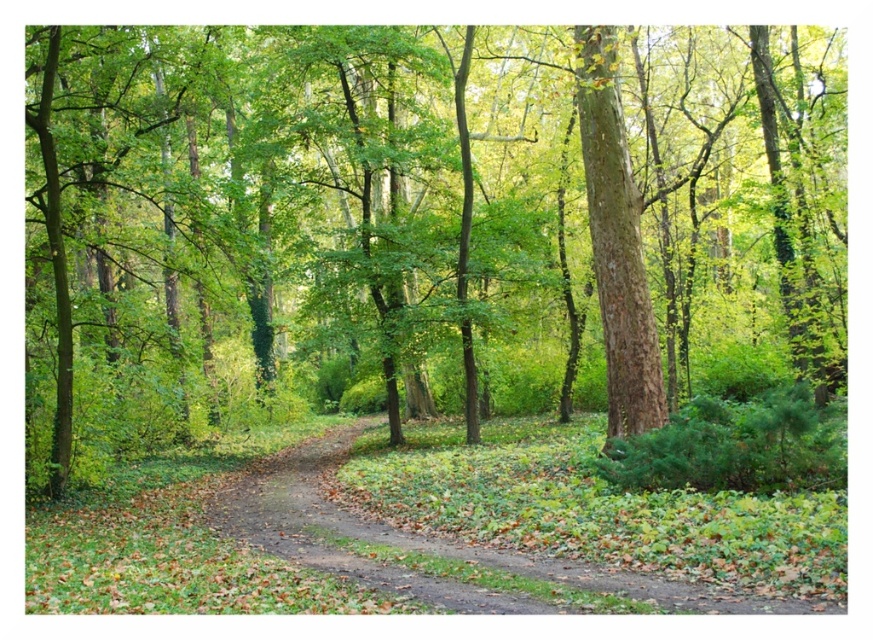
Between point (287, 465) and point (615, 326), which one is positioned behind?

The point (287, 465) is more distant.

Which is in front, point (620, 515) or point (605, 68)?

Point (620, 515) is more forward.

Find the location of a particular element. brown dirt path at center is located at coordinates (498, 531).

Describe the element at coordinates (414, 220) in the screenshot. This screenshot has height=640, width=873. I see `brown rough tree at center` at that location.

Which is in front, point (836, 228) or point (727, 509)?

Point (727, 509) is more forward.

Locate an element on the screen. Image resolution: width=873 pixels, height=640 pixels. brown rough tree at center is located at coordinates (414, 220).

Who is more distant from viewer, [215,106] or [638,209]?

The point [215,106] is more distant.

Image resolution: width=873 pixels, height=640 pixels. What do you see at coordinates (414, 220) in the screenshot?
I see `brown rough tree at center` at bounding box center [414, 220].

I want to click on brown rough tree at center, so click(x=414, y=220).